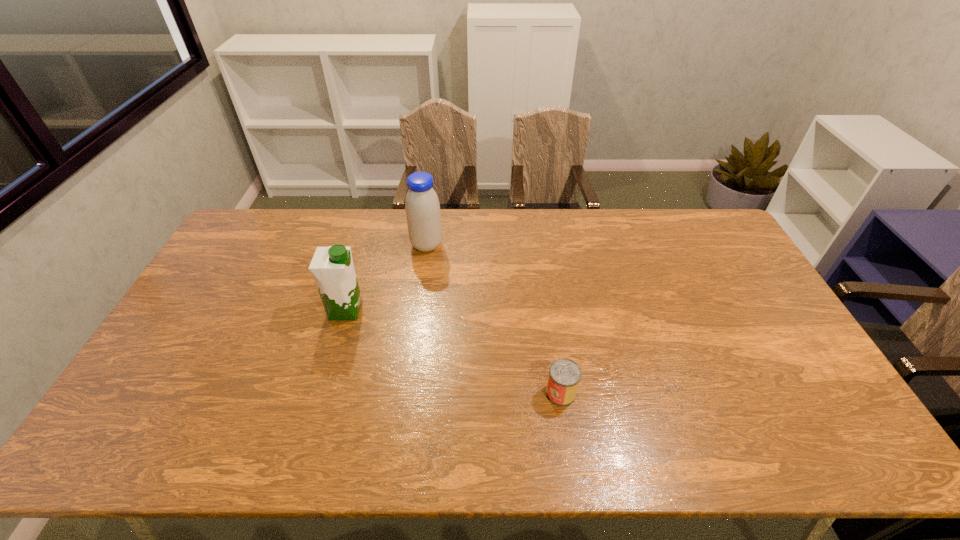
The image size is (960, 540). I want to click on the farther soya milk, so click(422, 207).

You are a GUI agent. You are given a task and a screenshot of the screen. Output one action in this format:
    pyautogui.click(x=<x>, y=<y>)
    Task: Click on the right soya milk
    The image size is (960, 540).
    Given the screenshot: What is the action you would take?
    pyautogui.click(x=422, y=207)

The width and height of the screenshot is (960, 540). I want to click on the nearer soya milk, so click(x=332, y=267).

I want to click on the leftmost object, so click(x=332, y=267).

Find the location of a particular element. the rightmost object is located at coordinates (564, 376).

Where is `the nearest object`? The height and width of the screenshot is (540, 960). the nearest object is located at coordinates pyautogui.click(x=564, y=376).

You are a GUI agent. You are given a task and a screenshot of the screen. Output one action in this format:
    pyautogui.click(x=<x>, y=<y>)
    Task: Click on the vacant region located on the right of the right soya milk
    The image size is (960, 540).
    Given the screenshot: What is the action you would take?
    (527, 245)

The height and width of the screenshot is (540, 960). What are the coordinates of `vacant space located 0.370m on the front-facing side of the left soya milk` in the screenshot? It's located at (485, 310).

The height and width of the screenshot is (540, 960). I want to click on free region located 0.200m on the right of the shortest object, so click(x=653, y=393).

You are a GUI agent. You are given a task and a screenshot of the screen. Output one action in this format:
    pyautogui.click(x=<x>, y=<y>)
    Task: Click on the object that is at the far edge
    This screenshot has width=960, height=540.
    Given the screenshot: What is the action you would take?
    coord(422,207)